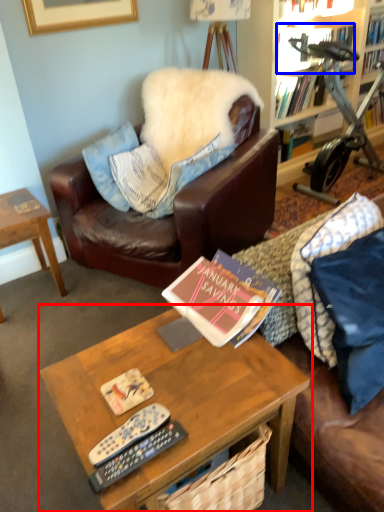
Question: Which object appears closest to the camera in this image, coffee table (highlighted by a red box) or book (highlighted by a blue box)?

Choices:
 (A) coffee table
 (B) book

Answer: (A)